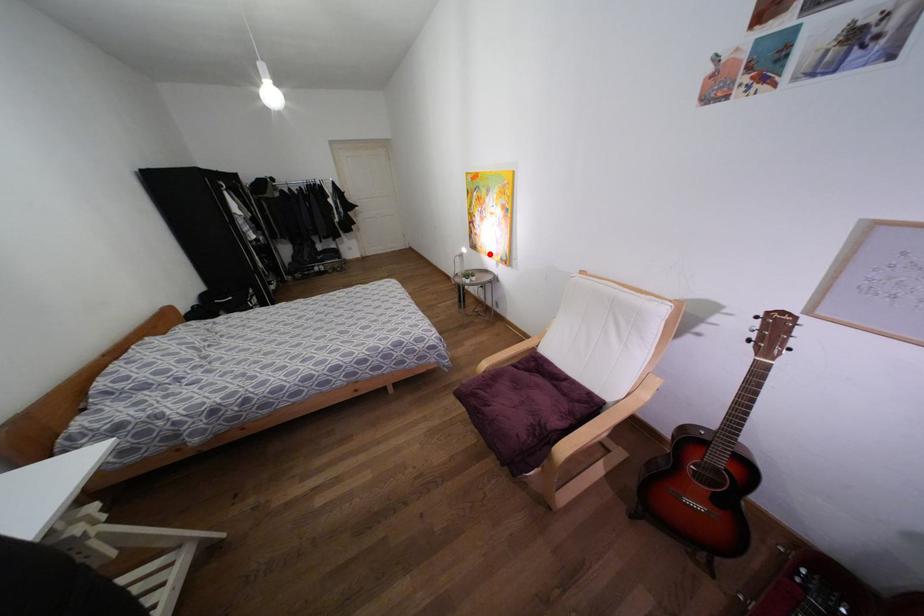
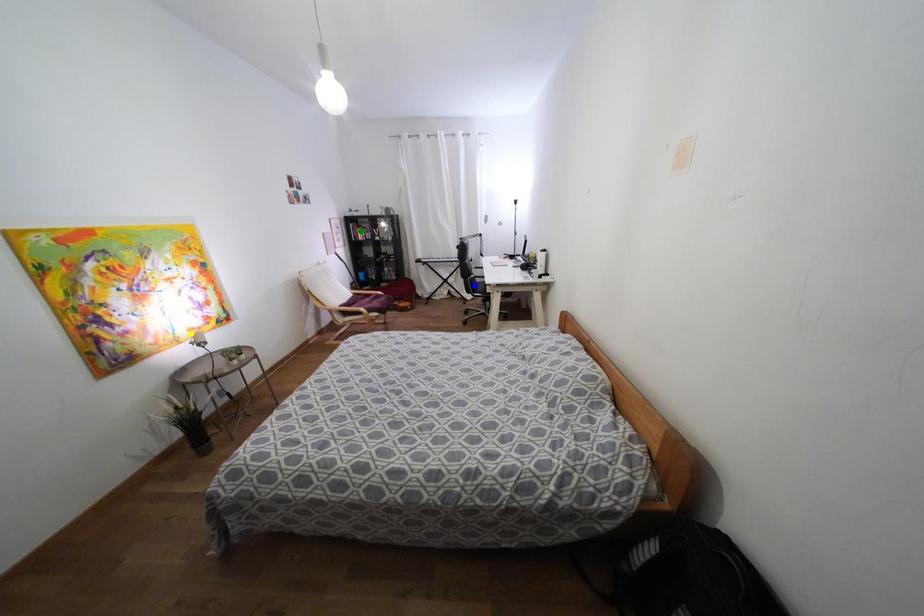
Question: I am providing you with two images of the same scene from different viewpoints. A red point is marked on the first image. You are given multiple points on the second image. Can you choose the point in image 2 that corresponds to the point in image 1?

Choices:
 (A) green point
 (B) blue point
 (C) yellow point

Answer: (C)